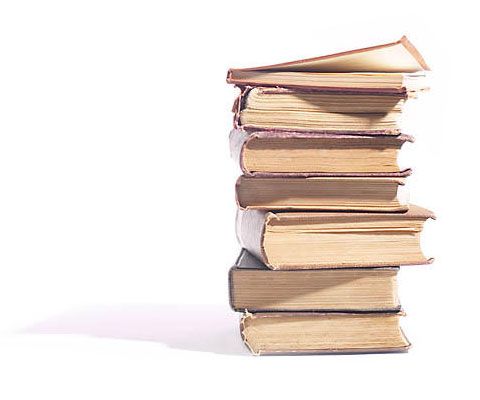
Find the location of a particular element. The image size is (480, 400). books is located at coordinates (311, 80), (306, 109), (303, 153), (301, 193), (312, 244), (298, 291), (312, 332).